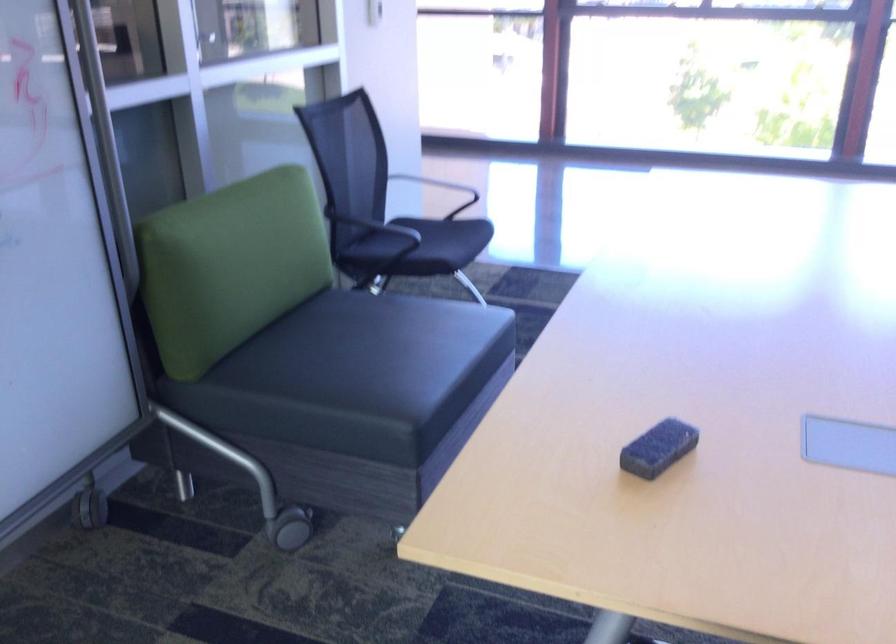
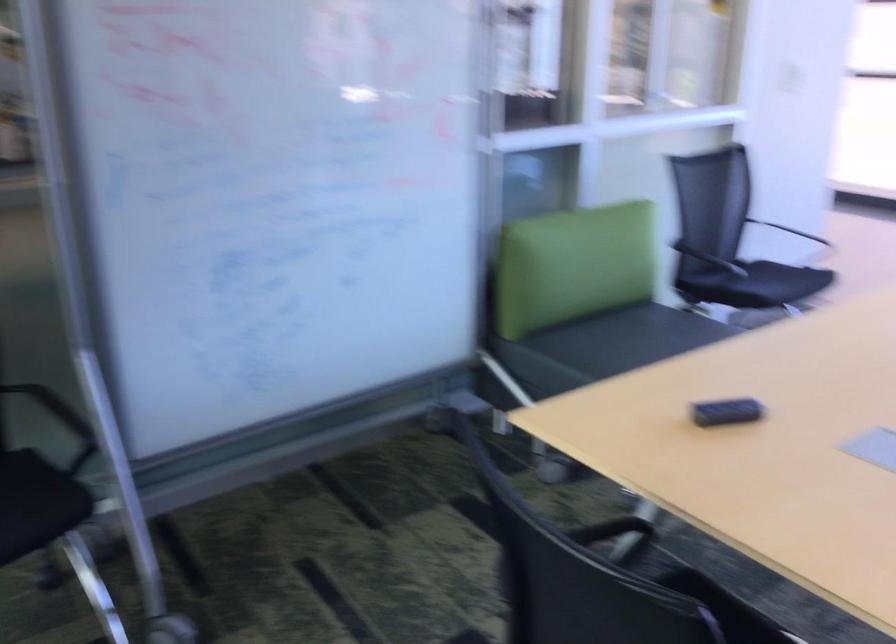
Question: The camera is either moving clockwise (left) or counter-clockwise (right) around the object. The first image is from the beginning of the video and the second image is from the end. Is the camera moving left or right when shooting the video?

Choices:
 (A) Left
 (B) Right

Answer: (B)